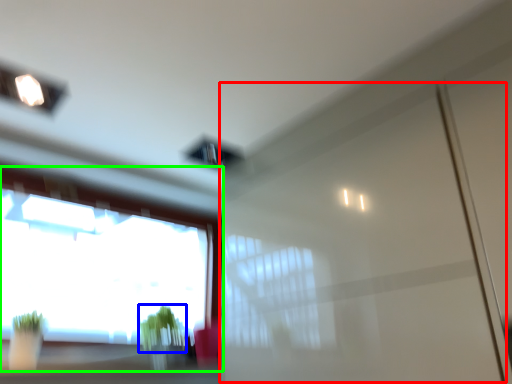
Question: Estimate the real-world distances between objects in this image. Which object is closer to screen door (highlighted by a red box), plant (highlighted by a blue box) or window (highlighted by a green box)?

Choices:
 (A) plant
 (B) window

Answer: (A)